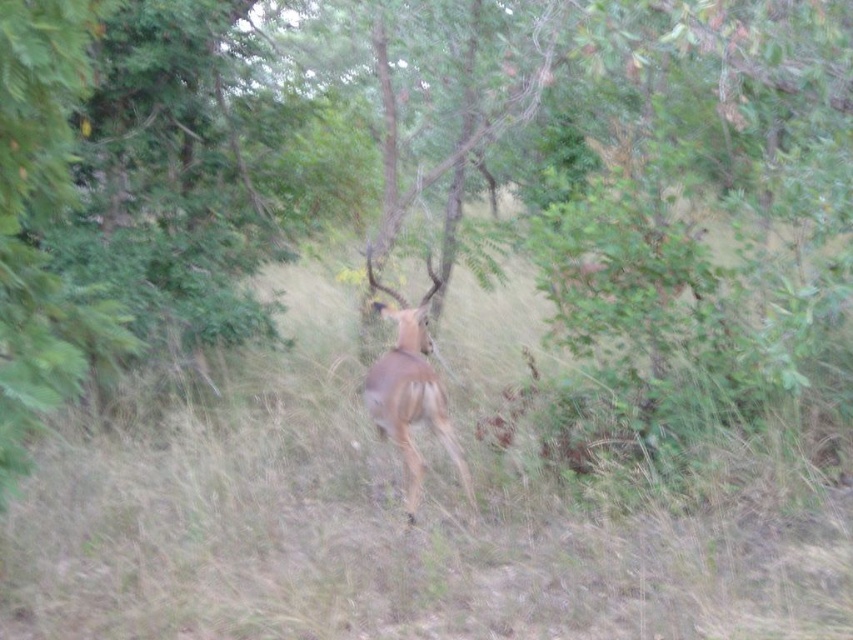
Question: Which of the following is the closest to the observer?

Choices:
 (A) (523, 611)
 (B) (450, 452)

Answer: (A)

Question: Which of the following is the closest to the observer?

Choices:
 (A) brown matte antelope at center
 (B) green grass at center

Answer: (B)

Question: Is green grass at center smaller than brown matte antelope at center?

Choices:
 (A) no
 (B) yes

Answer: (B)

Question: Can you confirm if green grass at center is positioned below brown matte antelope at center?

Choices:
 (A) yes
 (B) no

Answer: (A)

Question: Is green grass at center thinner than brown matte antelope at center?

Choices:
 (A) no
 (B) yes

Answer: (A)